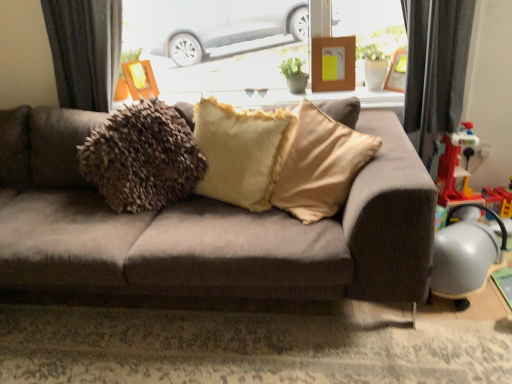
Question: Is fuzzy beige pillow at center inside suede-like brown couch at center?

Choices:
 (A) yes
 (B) no

Answer: (A)

Question: Considering the relative sizes of suede-like brown couch at center and fuzzy beige pillow at center in the image provided, is suede-like brown couch at center taller than fuzzy beige pillow at center?

Choices:
 (A) yes
 (B) no

Answer: (A)

Question: Are suede-like brown couch at center and fuzzy beige pillow at center located far from each other?

Choices:
 (A) no
 (B) yes

Answer: (A)

Question: Is suede-like brown couch at center to the right of fuzzy beige pillow at center from the viewer's perspective?

Choices:
 (A) yes
 (B) no

Answer: (B)

Question: Is suede-like brown couch at center thinner than fuzzy beige pillow at center?

Choices:
 (A) no
 (B) yes

Answer: (A)

Question: Is suede-like brown couch at center beside fuzzy beige pillow at center?

Choices:
 (A) yes
 (B) no

Answer: (B)

Question: Can you confirm if wooden picture frame at upper center, which is the 2th picture frame in left-to-right order, is positioned to the left of suede-like brown couch at center?

Choices:
 (A) no
 (B) yes

Answer: (A)

Question: Can you confirm if wooden picture frame at upper center, marked as the second picture frame in a right-to-left arrangement, is positioned to the right of suede-like brown couch at center?

Choices:
 (A) yes
 (B) no

Answer: (A)

Question: Considering the relative sizes of wooden picture frame at upper center, marked as the second picture frame in a right-to-left arrangement, and suede-like brown couch at center in the image provided, is wooden picture frame at upper center, marked as the second picture frame in a right-to-left arrangement, bigger than suede-like brown couch at center?

Choices:
 (A) no
 (B) yes

Answer: (A)

Question: Is wooden picture frame at upper center, marked as the second picture frame in a right-to-left arrangement, behind suede-like brown couch at center?

Choices:
 (A) no
 (B) yes

Answer: (B)

Question: Is wooden picture frame at upper center, which is the 2th picture frame in left-to-right order, smaller than suede-like brown couch at center?

Choices:
 (A) yes
 (B) no

Answer: (A)

Question: From the image's perspective, would you say wooden picture frame at upper center, marked as the second picture frame in a right-to-left arrangement, is positioned over suede-like brown couch at center?

Choices:
 (A) no
 (B) yes

Answer: (B)

Question: Is the surface of suede-like brown couch at center in direct contact with white glossy window sill at upper center?

Choices:
 (A) yes
 (B) no

Answer: (B)